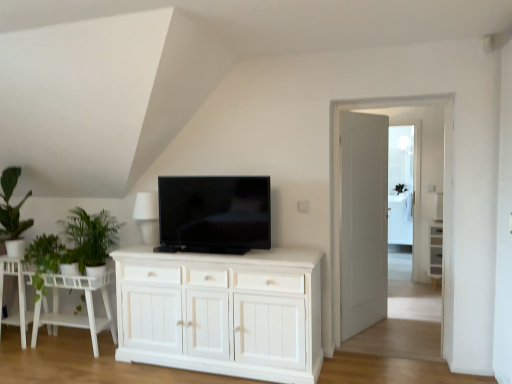
What is the approximate height of green leafy plant at left, the first plant from the right?

The height of green leafy plant at left, the first plant from the right, is 25.84 inches.

Where is `white wood table at lower left, marked as the second table in a left-to-right arrangement`? The width and height of the screenshot is (512, 384). white wood table at lower left, marked as the second table in a left-to-right arrangement is located at coordinates (76, 315).

This screenshot has width=512, height=384. What do you see at coordinates (413, 172) in the screenshot?
I see `transparent glass door at center, placed as the 2th glass door when sorted from back to front` at bounding box center [413, 172].

This screenshot has width=512, height=384. Describe the element at coordinates (18, 294) in the screenshot. I see `white wood side table at lower left, the first table from the left` at that location.

Where is `white wood cabinet at right`? white wood cabinet at right is located at coordinates (435, 252).

Measure the distance between point (157, 211) and camera.

Point (157, 211) is 3.68 meters from camera.

Image resolution: width=512 pixels, height=384 pixels. What do you see at coordinates (147, 216) in the screenshot?
I see `white matte lampshade at upper center` at bounding box center [147, 216].

Identify the location of green leafy plant at left, placed as the 2th plant when sorted from left to right. Image resolution: width=512 pixels, height=384 pixels. (91, 236).

From a real-world perspective, starting from the white wood side table at lower left, the first table from the left, which plant is the 2nd one vertically above it? Please provide its 2D coordinates.

[(91, 236)]

From the picture: Is green leafy plant at left, placed as the 2th plant when sorted from left to right, wider or thinner than white wood side table at lower left, acting as the 2th table starting from the right?

Considering their sizes, green leafy plant at left, placed as the 2th plant when sorted from left to right, looks broader than white wood side table at lower left, acting as the 2th table starting from the right.

Is green leafy plant at left, placed as the 2th plant when sorted from left to right, placed right next to white wood side table at lower left, the first table from the left?

No.

Who is smaller, green leafy plant at left, placed as the 2th plant when sorted from left to right, or white wood side table at lower left, the first table from the left?

white wood side table at lower left, the first table from the left, is smaller.

In the scene shown: From a real-world perspective, who is located higher, white wood side table at lower left, acting as the 2th table starting from the right, or green matte plant at left?

green matte plant at left is physically above.

Would you consider white wood side table at lower left, the first table from the left, to be distant from green matte plant at left?

No, white wood side table at lower left, the first table from the left, is not far from green matte plant at left.

From the image's perspective, which one is positioned lower, white wood side table at lower left, the first table from the left, or green matte plant at left?

From the image's view, white wood side table at lower left, the first table from the left, is below.

Could you tell me if white wood side table at lower left, the first table from the left, is turned towards green matte plant at left?

No, white wood side table at lower left, the first table from the left, does not turn towards green matte plant at left.

Is white wood side table at lower left, acting as the 2th table starting from the right, a part of green matte plant at left?

That's incorrect, white wood side table at lower left, acting as the 2th table starting from the right, is not inside green matte plant at left.

From the image's perspective, is green matte plant at left above or below white wood side table at lower left, the first table from the left?

green matte plant at left is above white wood side table at lower left, the first table from the left.

From a real-world perspective, is green matte plant at left positioned above or below white wood side table at lower left, acting as the 2th table starting from the right?

From a real-world perspective, green matte plant at left is physically above white wood side table at lower left, acting as the 2th table starting from the right.

Can we say transparent glass door at center, which appears as the first glass door when viewed from the front, lies outside transparent glass door at center, which appears as the 2th glass door when viewed from the front?

Yes, transparent glass door at center, which appears as the first glass door when viewed from the front, is not within transparent glass door at center, which appears as the 2th glass door when viewed from the front.

From the image's perspective, does transparent glass door at center, arranged as the 2th glass door when viewed from the right, appear higher than transparent glass door at center, which appears as the 2th glass door when viewed from the left?

No, from the image's perspective, transparent glass door at center, arranged as the 2th glass door when viewed from the right, is not on top of transparent glass door at center, which appears as the 2th glass door when viewed from the left.

There is a transparent glass door at center, which appears as the 2th glass door when viewed from the left. At what (x,y) coordinates should I click in order to perform the action: click on glass door above it (from a real-world perspective). Please return your answer as a coordinate pair (x, y). The height and width of the screenshot is (384, 512). Looking at the image, I should click on (413, 172).

In order to click on glass door in front of the white wooden door at center in this screenshot , I will do `click(413, 172)`.

Which of these two, transparent glass door at center, placed as the 2th glass door when sorted from back to front, or white wooden door at center, is bigger?

white wooden door at center.

In terms of width, does transparent glass door at center, placed as the 2th glass door when sorted from back to front, look wider or thinner when compared to white wooden door at center?

Considering their sizes, transparent glass door at center, placed as the 2th glass door when sorted from back to front, looks slimmer than white wooden door at center.

Which is more to the left, transparent glass door at center, placed as the 2th glass door when sorted from back to front, or white wooden door at center?

white wooden door at center is more to the left.

From a real-world perspective, is green leafy plant at left, the first plant in the left-to-right sequence, located beneath transparent glass door at center, the first glass door positioned from the right?

Indeed, from a real-world perspective, green leafy plant at left, the first plant in the left-to-right sequence, is positioned beneath transparent glass door at center, the first glass door positioned from the right.

From their relative heights in the image, would you say green leafy plant at left, which is the second plant from right to left, is taller or shorter than transparent glass door at center, the first glass door positioned from the right?

green leafy plant at left, which is the second plant from right to left, is shorter than transparent glass door at center, the first glass door positioned from the right.

Where is `the 2nd glass door counting from the right of the green leafy plant at left, which is the second plant from right to left`? The height and width of the screenshot is (384, 512). the 2nd glass door counting from the right of the green leafy plant at left, which is the second plant from right to left is located at coordinates (402, 184).

Which is more to the right, green leafy plant at left, which is the second plant from right to left, or transparent glass door at center, which appears as the 2th glass door when viewed from the front?

transparent glass door at center, which appears as the 2th glass door when viewed from the front, is more to the right.

From the picture: From the image's perspective, between black glossy tv at center and green leafy plant at left, the first plant in the left-to-right sequence, who is located below?

green leafy plant at left, the first plant in the left-to-right sequence, appears lower in the image.

Can green leafy plant at left, the first plant in the left-to-right sequence, be found inside black glossy tv at center?

No, green leafy plant at left, the first plant in the left-to-right sequence, is located outside of black glossy tv at center.

Is black glossy tv at center shorter than green leafy plant at left, which is the second plant from right to left?

No, black glossy tv at center is not shorter than green leafy plant at left, which is the second plant from right to left.

From a real-world perspective, which object rests below the other?

green leafy plant at left, the first plant in the left-to-right sequence.

There is a white wood side table at lower left, acting as the 2th table starting from the right. What are the coordinates of `the 2nd plant above it (from the image's perspective)` in the screenshot? It's located at (91, 236).

This screenshot has width=512, height=384. I want to click on table that is the 2nd one when counting backward from the green matte plant at left, so click(x=18, y=294).

When comparing their distances from white wood table at lower left, marked as the second table in a left-to-right arrangement, does black glossy tv at center or white matte lampshade at upper center seem closer?

white matte lampshade at upper center lies closer to white wood table at lower left, marked as the second table in a left-to-right arrangement, than the other object.

When comparing their distances from black glossy tv at center, does white wooden door at center or green leafy plant at left, the first plant from the right, seem further?

white wooden door at center lies further to black glossy tv at center than the other object.

From the image, which object appears to be farther from green leafy plant at left, placed as the 2th plant when sorted from left to right, transparent glass door at center, which appears as the first glass door when viewed from the back, or green matte plant at left?

transparent glass door at center, which appears as the first glass door when viewed from the back, is further to green leafy plant at left, placed as the 2th plant when sorted from left to right.

Which object lies further to the anchor point transparent glass door at center, the first glass door when ordered from left to right, white matte lampshade at upper center or black glossy tv at center?

white matte lampshade at upper center lies further to transparent glass door at center, the first glass door when ordered from left to right, than the other object.

Which object lies further to the anchor point white wood cabinet at right, white wooden door at center or transparent glass door at center, which appears as the 2th glass door when viewed from the left?

white wooden door at center lies further to white wood cabinet at right than the other object.

Looking at this image, when comparing their distances from white wood cabinet at right, does white wood table at lower left, which is the 1th table in right-to-left order, or transparent glass door at center, the first glass door positioned from the right, seem further?

white wood table at lower left, which is the 1th table in right-to-left order.

When comparing their distances from white wood cabinet at right, does white wood side table at lower left, acting as the 2th table starting from the right, or green leafy plant at left, the first plant from the right, seem closer?

green leafy plant at left, the first plant from the right, is closer to white wood cabinet at right.

From the image, which object appears to be farther from white wooden door at center, black glossy tv at center or white wood side table at lower left, the first table from the left?

white wood side table at lower left, the first table from the left, is positioned further to the anchor white wooden door at center.

Locate an element on the screen. plant between white wood table at lower left, which is the 1th table in right-to-left order, and white wood cabinet at right is located at coordinates (91, 236).

Identify the location of table between green leafy plant at left, which is the second plant from right to left, and white wooden door at center. The width and height of the screenshot is (512, 384). (76, 315).

Image resolution: width=512 pixels, height=384 pixels. Identify the location of television between white wood table at lower left, marked as the second table in a left-to-right arrangement, and transparent glass door at center, which appears as the 2th glass door when viewed from the left, in the horizontal direction. (214, 214).

Identify the location of television located between green leafy plant at left, which is the second plant from right to left, and transparent glass door at center, which appears as the first glass door when viewed from the front, in the left-right direction. (214, 214).